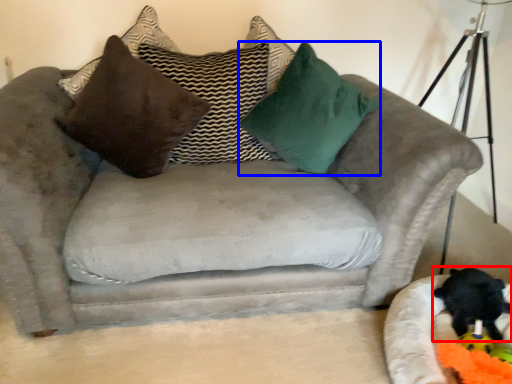
Question: Which object appears farthest to the camera in this image, animal (highlighted by a red box) or pillow (highlighted by a blue box)?

Choices:
 (A) animal
 (B) pillow

Answer: (B)